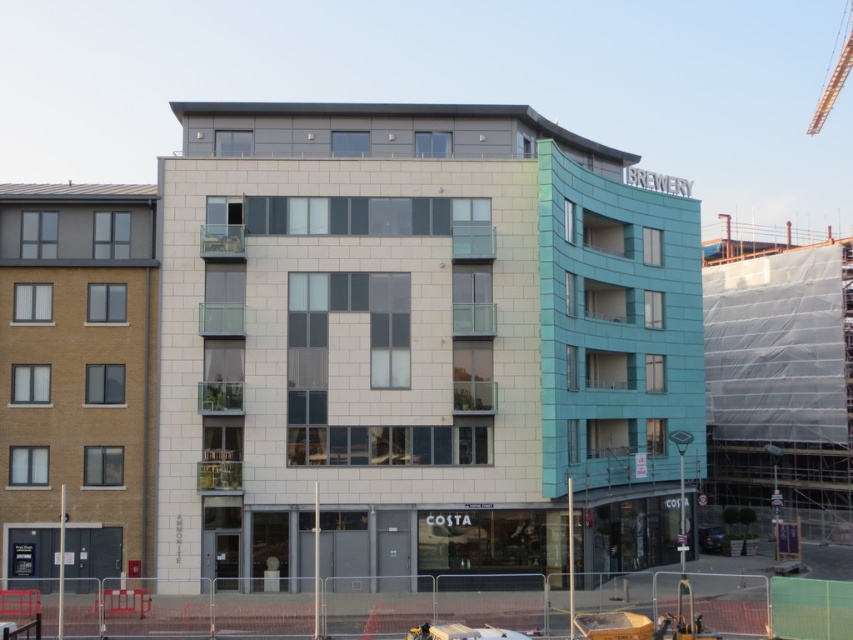
Question: Can you confirm if white textured building at center is thinner than metallic red crane at upper right?

Choices:
 (A) no
 (B) yes

Answer: (B)

Question: Which point is closer to the camera?

Choices:
 (A) metallic red crane at upper right
 (B) white textured building at center

Answer: (B)

Question: Can you confirm if white textured building at center is smaller than metallic red crane at upper right?

Choices:
 (A) no
 (B) yes

Answer: (B)

Question: Which point appears farthest from the camera in this image?

Choices:
 (A) (845, 76)
 (B) (451, 308)

Answer: (A)

Question: In this image, where is white textured building at center located relative to metallic red crane at upper right?

Choices:
 (A) below
 (B) above

Answer: (A)